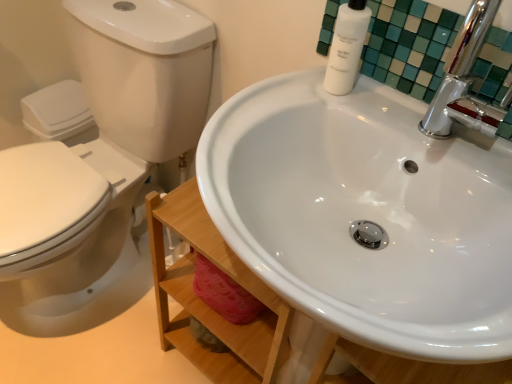
Find the location of a particular element. space that is in front of white matte bottle at upper right is located at coordinates (343, 119).